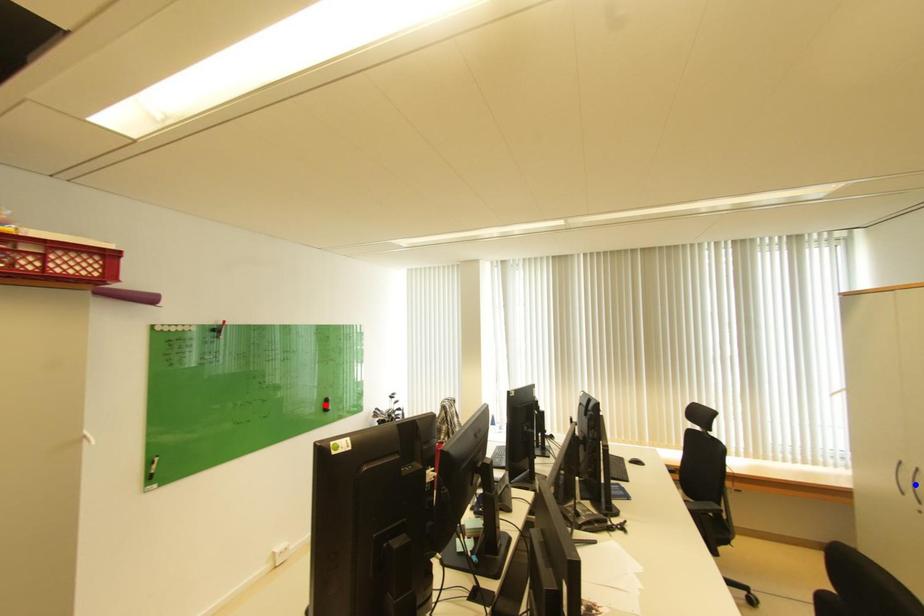
Question: In the image, two points are highlighted. Which point is nearer to the camera? Reply with the corresponding letter.

Choices:
 (A) blue point
 (B) red point

Answer: (A)